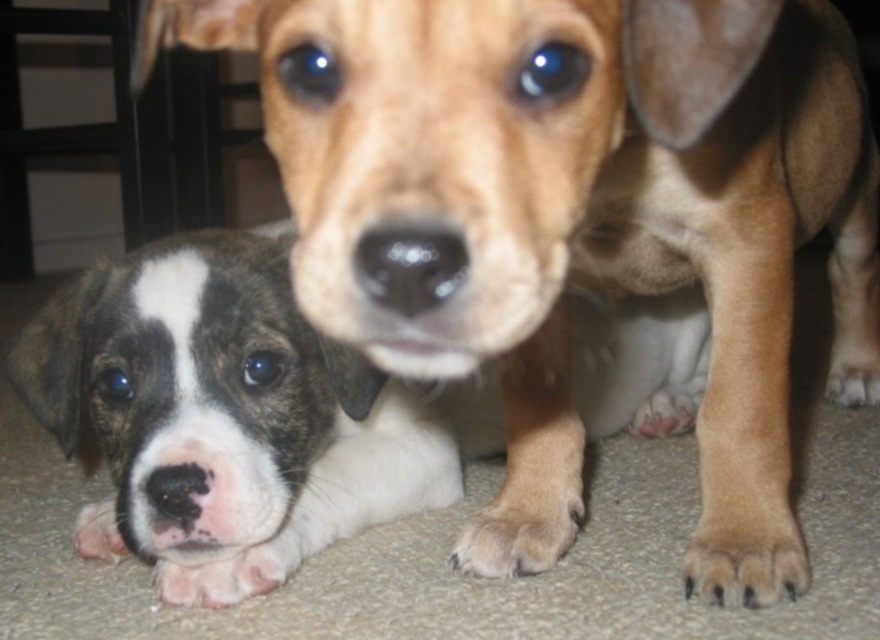
Question: Is brown/white fur puppy at lower left smaller than brown fur paw at lower center?

Choices:
 (A) yes
 (B) no

Answer: (B)

Question: Which object is positioned closest to the brown fur paw at lower right?

Choices:
 (A) pink soft fur paw at lower left
 (B) brown furry paw at lower right

Answer: (B)

Question: Among these objects, which one is farthest from the camera?

Choices:
 (A) brown furry paw at lower right
 (B) brown fur paw at lower right

Answer: (B)

Question: In this image, where is brown/white fur puppy at lower left located relative to brown fur paw at lower center?

Choices:
 (A) below
 (B) above

Answer: (B)

Question: Can you confirm if brown furry paw at lower right is wider than brown fur paw at lower center?

Choices:
 (A) yes
 (B) no

Answer: (B)

Question: Which object is farther from the camera taking this photo?

Choices:
 (A) brown fur paw at lower right
 (B) pink soft fur paw at lower left

Answer: (A)